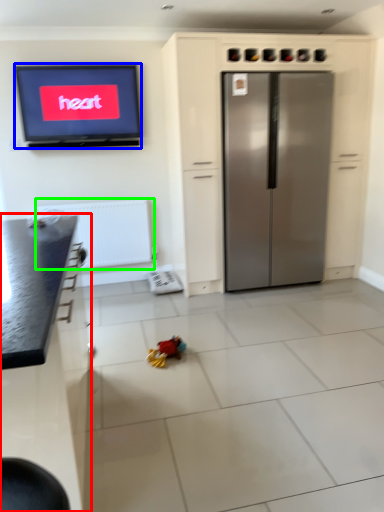
Question: Estimate the real-world distances between objects in this image. Which object is closer to cabinetry (highlighted by a red box), television (highlighted by a blue box) or radiator (highlighted by a green box)?

Choices:
 (A) television
 (B) radiator

Answer: (B)